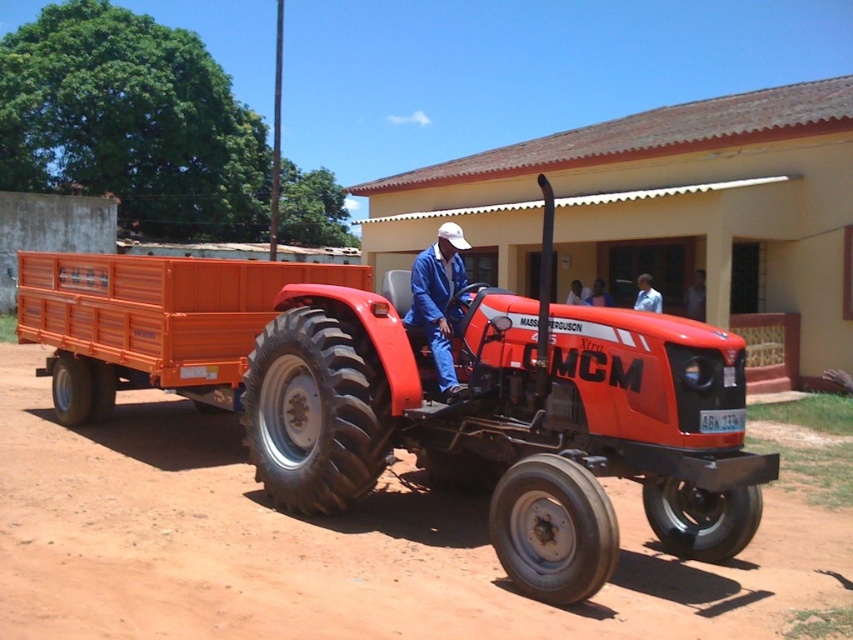
Can you confirm if matte orange trailer at center is positioned below blue fabric shirt at center?

Actually, matte orange trailer at center is above blue fabric shirt at center.

Does matte orange trailer at center appear on the left side of blue fabric shirt at center?

Correct, you'll find matte orange trailer at center to the left of blue fabric shirt at center.

Is point (457, 308) closer to camera compared to point (640, 300)?

Yes, it is.

At what (x,y) coordinates should I click in order to perform the action: click on matte orange trailer at center. Please return your answer as a coordinate pair (x, y). Looking at the image, I should click on (425, 396).

Can you confirm if orange plastic wagon at center is positioned above blue fabric shirt at center?

Indeed, orange plastic wagon at center is positioned over blue fabric shirt at center.

Between orange plastic wagon at center and blue fabric shirt at center, which one appears on the left side from the viewer's perspective?

From the viewer's perspective, orange plastic wagon at center appears more on the left side.

Locate an element on the screen. orange plastic wagon at center is located at coordinates (151, 323).

The height and width of the screenshot is (640, 853). I want to click on orange plastic wagon at center, so click(x=151, y=323).

Which is above, matte orange trailer at center or orange plastic wagon at center?

orange plastic wagon at center

Between point (587, 372) and point (138, 278), which one is positioned behind?

Point (138, 278)

The width and height of the screenshot is (853, 640). I want to click on matte orange trailer at center, so click(x=425, y=396).